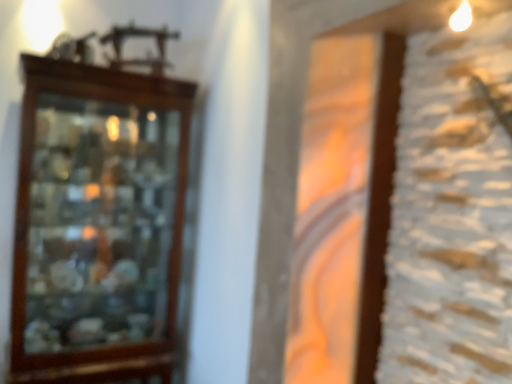
Question: Should I look upward or downward to see brown wooden cabinet at left?

Choices:
 (A) up
 (B) down

Answer: (B)